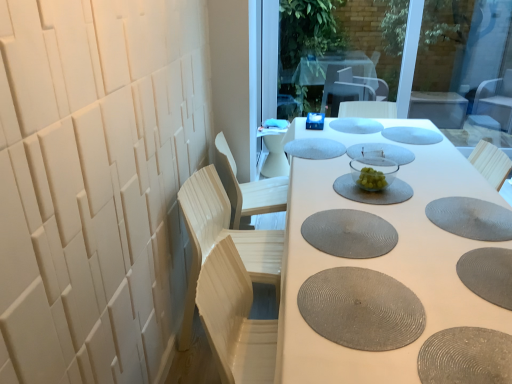
The height and width of the screenshot is (384, 512). In order to click on vacant space in between gray textured placemat at lower right, the eighth manhole cover in the back-to-front sequence, and gray textured placemat at center, placed as the seventh manhole cover when sorted from back to front in this screenshot , I will do `click(418, 256)`.